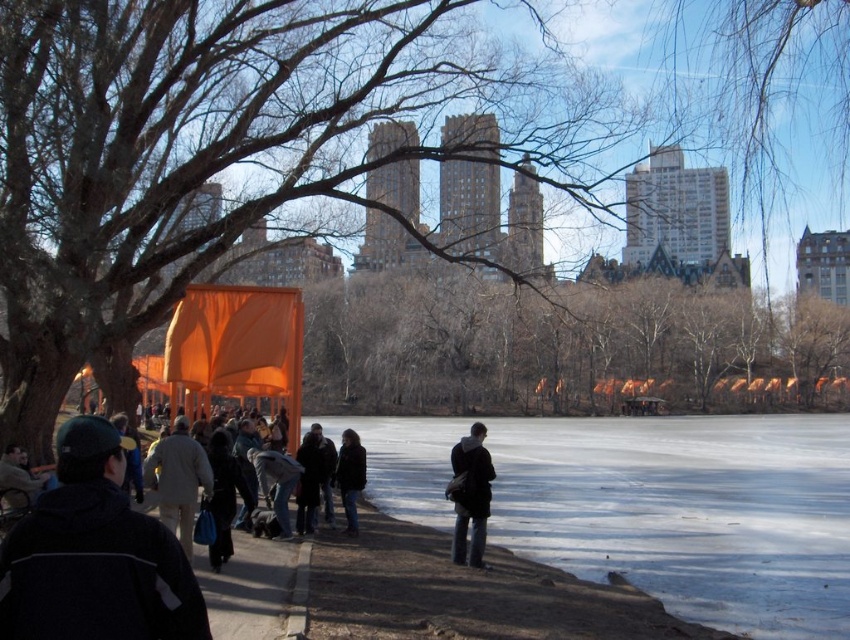
Can you confirm if orange fabric at center is shorter than dark brown leather jacket at center?

In fact, orange fabric at center may be taller than dark brown leather jacket at center.

Who is positioned more to the left, orange fabric at center or dark brown leather jacket at center?

dark brown leather jacket at center is more to the left.

The width and height of the screenshot is (850, 640). Find the location of `orange fabric at center`. orange fabric at center is located at coordinates (564, 348).

In order to click on orange fabric at center in this screenshot , I will do `click(564, 348)`.

Does orange fabric at center appear over dark gray jacket at center?

Yes, orange fabric at center is above dark gray jacket at center.

Between orange fabric at center and dark gray jacket at center, which one has less height?

With less height is dark gray jacket at center.

This screenshot has width=850, height=640. Describe the element at coordinates (564, 348) in the screenshot. I see `orange fabric at center` at that location.

Where is `orange fabric at center`? This screenshot has height=640, width=850. orange fabric at center is located at coordinates (564, 348).

Between dark brown leather jacket at center and dark gray coat at center, which one is positioned higher?

dark gray coat at center

Is dark brown leather jacket at center further to camera compared to dark gray coat at center?

Yes, it is.

What are the coordinates of `dark brown leather jacket at center` in the screenshot? It's located at (350, 476).